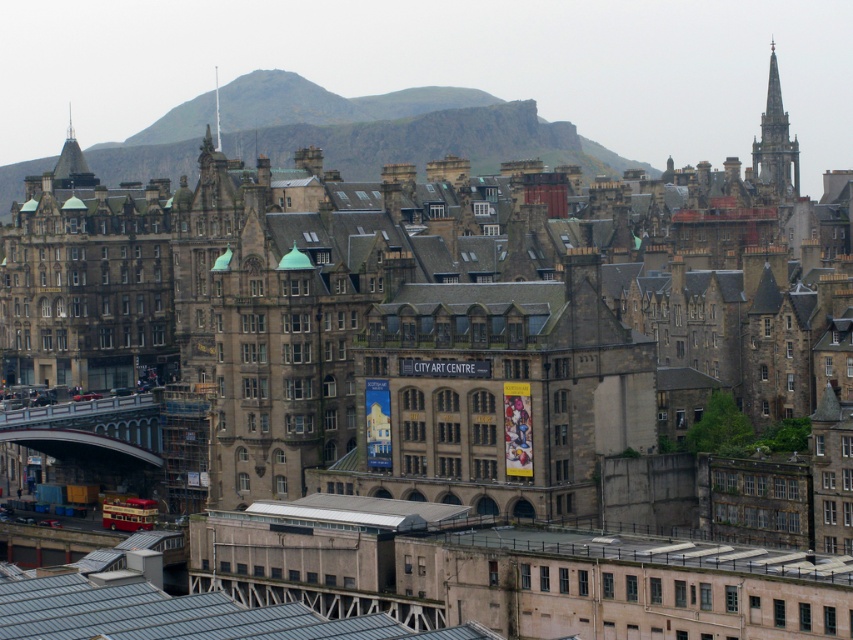
Looking at the Edinburgh cityscape, you notice two stone spires in the distance. Which one is bigger between the stone spire at upper right and the smooth stone spire at upper center?

The stone spire at upper right is larger in size compared to the smooth stone spire at upper center.

You are an architect analyzing the skyline of Edinburgh. You notice two spires in the image. Which spire, the stone spire at upper right or the shiny gold spire at upper left, is taller?

The shiny gold spire at upper left is taller than the stone spire at upper right.

You are an architect analyzing the skyline of Edinburgh. You notice two spires in the image. Which spire, the shiny gold spire at upper left or the smooth stone spire at upper center, is larger in size?

The shiny gold spire at upper left is bigger than the smooth stone spire at upper center.